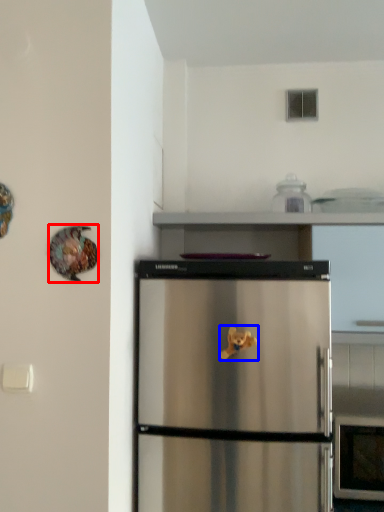
Question: Which object is further to the camera taking this photo, animal (highlighted by a red box) or toy (highlighted by a blue box)?

Choices:
 (A) animal
 (B) toy

Answer: (B)